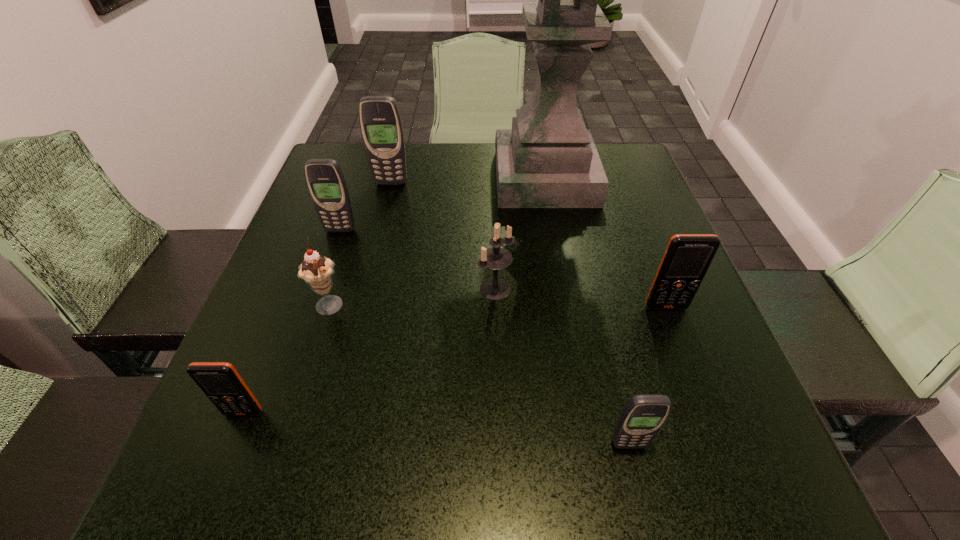
Image resolution: width=960 pixels, height=540 pixels. I want to click on vacant space located on the back of the icecream, so click(370, 179).

Identify the location of free region located 0.060m on the front of the candle holder. (496, 330).

Image resolution: width=960 pixels, height=540 pixels. Find the location of `vacant space located on the screen of the nearer orange cellular telephone`. vacant space located on the screen of the nearer orange cellular telephone is located at coordinates (229, 449).

The width and height of the screenshot is (960, 540). I want to click on blank area located on the screen of the nearest gray cellular telephone, so click(643, 508).

At what (x,y) coordinates should I click in order to perform the action: click on sculpture located in the far edge section of the desktop. Please return your answer as a coordinate pair (x, y). Looking at the image, I should click on (549, 159).

Find the location of a particular element. This screenshot has width=960, height=540. cellular telephone that is positioned at the far edge is located at coordinates (381, 126).

The image size is (960, 540). What are the coordinates of `object situated at the near edge` in the screenshot? It's located at (643, 416).

The image size is (960, 540). Find the location of `icecream present at the left edge`. icecream present at the left edge is located at coordinates (316, 270).

You are a GUI agent. You are given a task and a screenshot of the screen. Output one action in this format:
    pyautogui.click(x=<x>, y=<y>)
    Task: Click on the sculpture that is at the right edge
    This screenshot has width=960, height=540.
    Given the screenshot: What is the action you would take?
    pyautogui.click(x=549, y=159)

Identify the location of cellular telephone that is positioned at the right edge. The height and width of the screenshot is (540, 960). (687, 258).